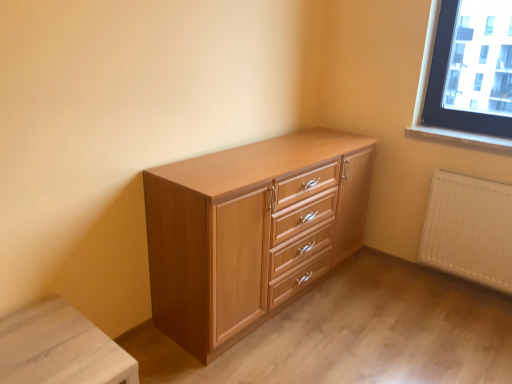
Locate an element on the screen. vacant space underneath white matte radiator at lower right (from a real-world perspective) is located at coordinates (458, 287).